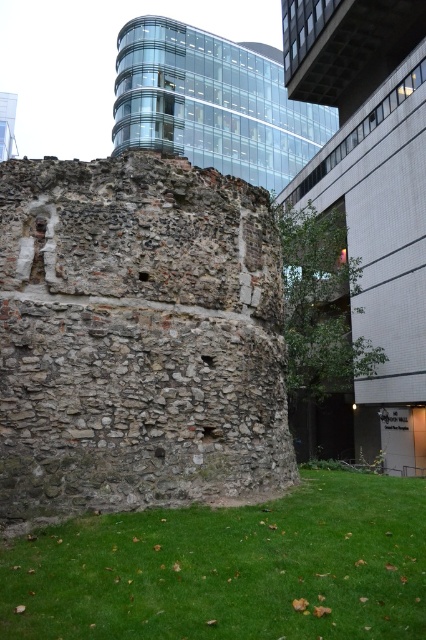
Question: Can you confirm if rustic stone ruins at center is wider than clear glass building at upper center?

Choices:
 (A) no
 (B) yes

Answer: (A)

Question: Is the position of rustic stone ruins at center less distant than that of stone wall at center?

Choices:
 (A) yes
 (B) no

Answer: (A)

Question: Which point is farther to the camera?

Choices:
 (A) clear glass building at upper center
 (B) rustic stone ruins at center

Answer: (A)

Question: Among these points, which one is farthest from the camera?

Choices:
 (A) (405, 72)
 (B) (152, 326)
 (C) (317, 131)
 (D) (233, 582)

Answer: (C)

Question: From the image, what is the correct spatial relationship of rustic stone ruins at center in relation to stone wall at center?

Choices:
 (A) right
 (B) left

Answer: (B)

Question: Which object is the farthest from the green grass at lower center?

Choices:
 (A) rustic stone ruins at center
 (B) stone wall at center

Answer: (B)